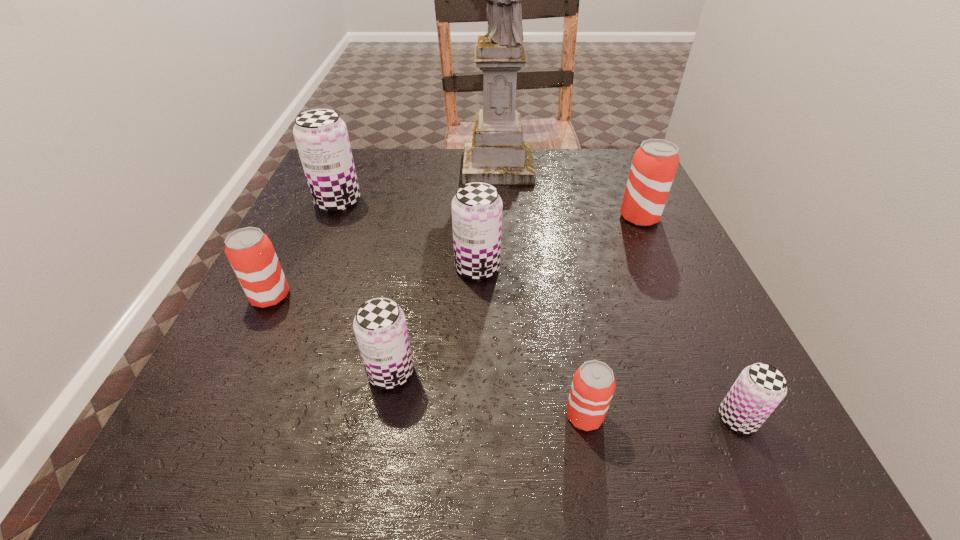
Locate an element on the screen. Image resolution: width=960 pixels, height=540 pixels. the third nearest beer can is located at coordinates (380, 327).

At what (x,y) coordinates should I click in order to perform the action: click on the second smallest purple beer can. Please return your answer as a coordinate pair (x, y). Image resolution: width=960 pixels, height=540 pixels. Looking at the image, I should click on (380, 327).

The width and height of the screenshot is (960, 540). I want to click on the nearest purple beer can, so click(759, 389).

Locate an element on the screen. The image size is (960, 540). the smallest purple beer can is located at coordinates (759, 389).

Find the location of a particular element. the fifth beer can from left to right is located at coordinates (593, 386).

You are a GUI agent. You are given a task and a screenshot of the screen. Output one action in this format:
    pyautogui.click(x=<x>, y=<y>)
    Task: Click on the nearest orange beer can
    This screenshot has width=960, height=540.
    Given the screenshot: What is the action you would take?
    pyautogui.click(x=593, y=386)

At what (x,y) coordinates should I click in order to perform the action: click on vacant point located 0.360m on the front-facing side of the gray sculpture. Please return your answer as a coordinate pair (x, y). Looking at the image, I should click on (322, 166).

You are a GUI agent. You are given a task and a screenshot of the screen. Output one action in this format:
    pyautogui.click(x=<x>, y=<y>)
    Task: Click on the vacant area situated on the front-facing side of the gray sculpture
    
    Given the screenshot: What is the action you would take?
    pyautogui.click(x=338, y=166)

The width and height of the screenshot is (960, 540). Find the location of `vacant space located on the front-facing side of the gray sculpture`. vacant space located on the front-facing side of the gray sculpture is located at coordinates (412, 166).

Image resolution: width=960 pixels, height=540 pixels. I want to click on vacant region located 0.380m on the front of the second tallest object, so click(x=274, y=355).